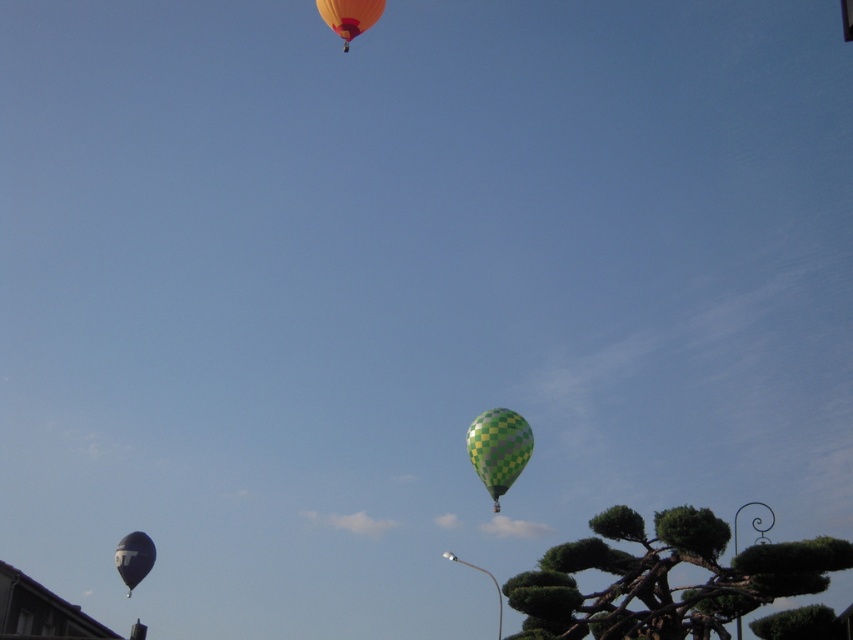
You are a drone operator who needs to fly a drone from the green checkered tree at lower right to the orange glossy balloon at upper center. What is the minimum distance you need to cover?

The minimum distance you need to cover is 77.81 meters between the green checkered tree at lower right and the orange glossy balloon at upper center.

You are standing on the ground and see both the green checkered tree at lower right and the green checkered balloon at center. How far apart are they from each other?

The green checkered tree at lower right and green checkered balloon at center are 73.21 meters apart from each other.